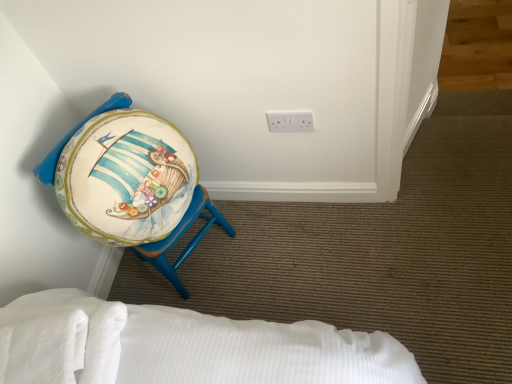
Question: Would you consider matte painted stool at left to be distant from white plastic electric outlet at upper center?

Choices:
 (A) yes
 (B) no

Answer: (B)

Question: Can you confirm if matte painted stool at left is taller than white plastic electric outlet at upper center?

Choices:
 (A) no
 (B) yes

Answer: (B)

Question: Is matte painted stool at left further to the viewer compared to white plastic electric outlet at upper center?

Choices:
 (A) no
 (B) yes

Answer: (A)

Question: From the image's perspective, is matte painted stool at left on top of white plastic electric outlet at upper center?

Choices:
 (A) no
 (B) yes

Answer: (A)

Question: From the image's perspective, is matte painted stool at left below white plastic electric outlet at upper center?

Choices:
 (A) no
 (B) yes

Answer: (B)

Question: Considering the relative positions of white soft towel at lower left and white plastic electric outlet at upper center in the image provided, is white soft towel at lower left to the left or to the right of white plastic electric outlet at upper center?

Choices:
 (A) left
 (B) right

Answer: (A)

Question: In terms of width, does white soft towel at lower left look wider or thinner when compared to white plastic electric outlet at upper center?

Choices:
 (A) wide
 (B) thin

Answer: (A)

Question: From a real-world perspective, is white soft towel at lower left physically located above or below white plastic electric outlet at upper center?

Choices:
 (A) below
 (B) above

Answer: (B)

Question: Considering the positions of white soft towel at lower left and white plastic electric outlet at upper center in the image, is white soft towel at lower left bigger or smaller than white plastic electric outlet at upper center?

Choices:
 (A) big
 (B) small

Answer: (A)

Question: From the image's perspective, is matte painted stool at left above or below white plastic electric outlet at upper center?

Choices:
 (A) above
 (B) below

Answer: (B)

Question: From a real-world perspective, is matte painted stool at left positioned above or below white plastic electric outlet at upper center?

Choices:
 (A) below
 (B) above

Answer: (A)

Question: Considering the positions of matte painted stool at left and white plastic electric outlet at upper center in the image, is matte painted stool at left taller or shorter than white plastic electric outlet at upper center?

Choices:
 (A) tall
 (B) short

Answer: (A)

Question: Is point (87, 226) closer or farther from the camera than point (305, 125)?

Choices:
 (A) closer
 (B) farther

Answer: (A)

Question: Is white soft towel at lower left taller or shorter than matte painted stool at left?

Choices:
 (A) short
 (B) tall

Answer: (A)

Question: Is white soft towel at lower left in front of or behind matte painted stool at left in the image?

Choices:
 (A) behind
 (B) front

Answer: (B)